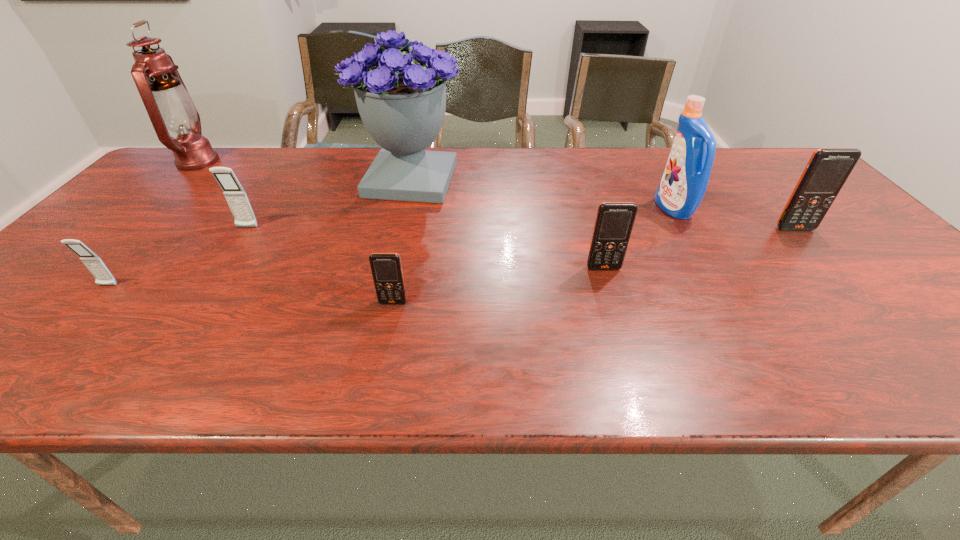
The height and width of the screenshot is (540, 960). In the image, there is a desktop. Find the location of `vacant space at the far edge`. vacant space at the far edge is located at coordinates (328, 152).

In the image, there is a desktop. Identify the location of vacant space at the near edge. (703, 371).

Image resolution: width=960 pixels, height=540 pixels. What are the coordinates of `blank space at the left edge` in the screenshot? It's located at (62, 336).

Identify the location of free space at the right edge of the desktop. This screenshot has width=960, height=540. (832, 261).

Locate an element on the screen. vacant space at the near left corner of the desktop is located at coordinates (31, 366).

The height and width of the screenshot is (540, 960). What are the coordinates of `empty space between the rightmost object and the sixth shortest object` in the screenshot? It's located at (734, 219).

Locate an element on the screen. free space between the red oil lamp and the smaller gray cellular telephone is located at coordinates (153, 224).

You are a GUI agent. You are given a task and a screenshot of the screen. Output one action in this format:
    pyautogui.click(x=<x>, y=<y>)
    Task: Click on the vacant space that is in between the seventh object from left to right and the rightmost cellular telephone
    
    Given the screenshot: What is the action you would take?
    (x=734, y=219)

The image size is (960, 540). Find the location of `free space between the nearest object and the oil lamp`. free space between the nearest object and the oil lamp is located at coordinates pyautogui.click(x=296, y=232).

Locate an element on the screen. The image size is (960, 540). free space between the oil lamp and the third object from left to right is located at coordinates (223, 194).